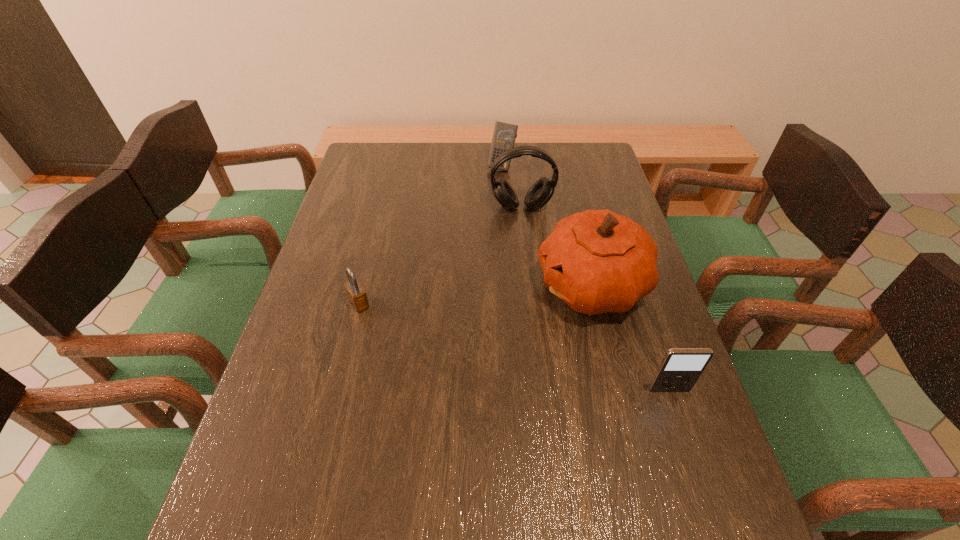
Identify the location of padlock. The width and height of the screenshot is (960, 540). (356, 294).

Where is `the leftmost object`? The height and width of the screenshot is (540, 960). the leftmost object is located at coordinates (356, 294).

This screenshot has height=540, width=960. Find the location of `iPod`. iPod is located at coordinates (680, 369).

You are a GUI agent. You are given a task and a screenshot of the screen. Output one action in this format:
    pyautogui.click(x=<x>, y=<y>)
    Task: Click on the pumpkin
    
    Given the screenshot: What is the action you would take?
    pyautogui.click(x=597, y=261)

Where is `the farthest object`? the farthest object is located at coordinates (504, 135).

Locate an element on the screen. Image resolution: width=960 pixels, height=540 pixels. the second farthest object is located at coordinates (540, 193).

At what (x,y) coordinates should I click in order to perform the action: click on free space located 0.180m on the right of the leftmost object. Please return your answer as a coordinate pair (x, y). Image resolution: width=960 pixels, height=540 pixels. Looking at the image, I should click on (442, 303).

The height and width of the screenshot is (540, 960). Identify the location of free space located 0.170m on the front-facing side of the nearest object. (698, 475).

This screenshot has width=960, height=540. Identify the location of vacant space located 0.220m on the front-facing side of the pumpkin. (462, 329).

In order to click on free space located 0.100m on the front-facing side of the pumpkin in this screenshot , I will do `click(507, 314)`.